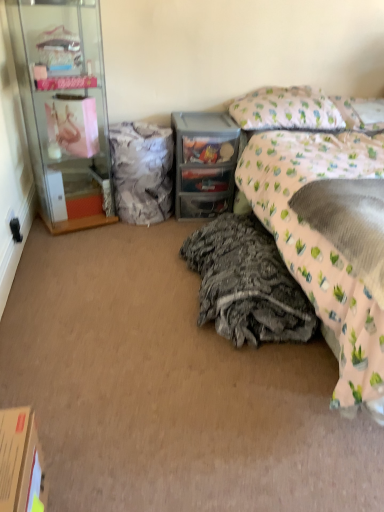
The height and width of the screenshot is (512, 384). In order to click on vacant space in between cardboard box at lower left and white textured fabric at center, which appears as the 2th material when viewed from the right in this screenshot , I will do `click(98, 329)`.